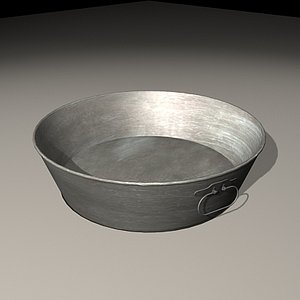
Identify the location of blank space, white table. The width and height of the screenshot is (300, 300). (45, 264).